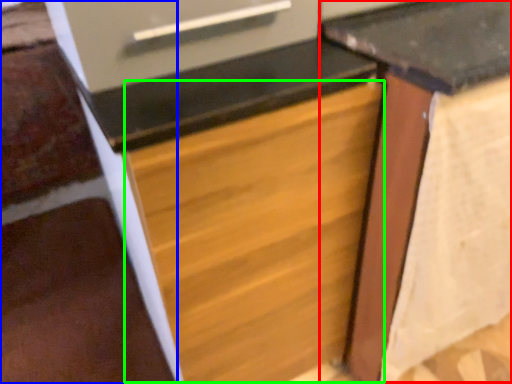
Question: Which is nearer to the table (highlighted by a red box)? stairwell (highlighted by a blue box) or drawer (highlighted by a green box).

Choices:
 (A) stairwell
 (B) drawer

Answer: (B)